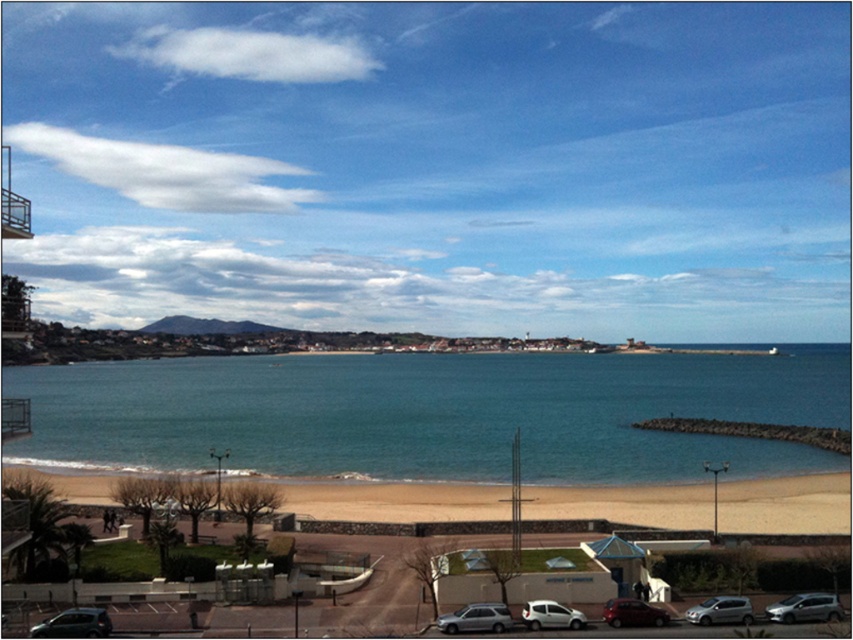
In the scene shown: Which is more to the right, silver metallic hatchback at lower right or white matte van at lower center?

silver metallic hatchback at lower right

Does point (801, 612) come closer to viewer compared to point (561, 604)?

Yes, it is in front of point (561, 604).

At what (x,y) coordinates should I click in order to perform the action: click on silver metallic hatchback at lower right. Please return your answer as a coordinate pair (x, y). Looking at the image, I should click on (805, 609).

Does silver metallic hatchback at lower right have a larger size compared to silver metallic car at lower center?

Yes.

Does point (769, 608) lie in front of point (469, 614)?

No, (769, 608) is behind (469, 614).

Locate an element on the screen. silver metallic hatchback at lower right is located at coordinates (805, 609).

Who is positioned more to the left, blue water at center or silver metallic car at lower right?

Positioned to the left is silver metallic car at lower right.

Between point (802, 394) and point (724, 618), which one is positioned behind?

The point (802, 394) is more distant.

The width and height of the screenshot is (853, 640). What are the coordinates of `blue water at center` in the screenshot? It's located at (432, 413).